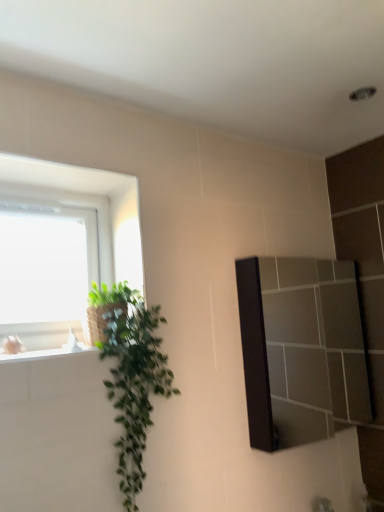
This screenshot has width=384, height=512. What do you see at coordinates (302, 349) in the screenshot?
I see `matte black mirror at right` at bounding box center [302, 349].

Where is `matte black mirror at right`? matte black mirror at right is located at coordinates (302, 349).

Describe the element at coordinates (131, 375) in the screenshot. The height and width of the screenshot is (512, 384). I see `green leafy plant at left` at that location.

You are a GUI agent. You are given a task and a screenshot of the screen. Output one action in this format:
    pyautogui.click(x=<x>, y=<y>)
    Task: Click on the green leafy plant at left
    The width and height of the screenshot is (384, 512).
    Given the screenshot: What is the action you would take?
    pyautogui.click(x=131, y=375)

You are a GUI agent. You are given a task and a screenshot of the screen. Output one action in this format:
    pyautogui.click(x=<x>, y=<y>)
    Task: Click on the matte black mirror at right
    
    Given the screenshot: What is the action you would take?
    pyautogui.click(x=302, y=349)

In the scene shown: Which object is positioned more to the right, matte black mirror at right or green leafy plant at left?

From the viewer's perspective, matte black mirror at right appears more on the right side.

Considering their positions, is matte black mirror at right located in front of or behind green leafy plant at left?

Clearly, matte black mirror at right is behind green leafy plant at left.

Is point (328, 377) farther from viewer compared to point (130, 398)?

Yes, point (328, 377) is behind point (130, 398).

From the image's perspective, is matte black mirror at right beneath green leafy plant at left?

No, from the image's perspective, matte black mirror at right is not beneath green leafy plant at left.

From a real-world perspective, between matte black mirror at right and green leafy plant at left, who is vertically higher?

matte black mirror at right.

Based on the photo, is matte black mirror at right wider or thinner than green leafy plant at left?

Clearly, matte black mirror at right has less width compared to green leafy plant at left.

Is matte black mirror at right shorter than green leafy plant at left?

Yes, matte black mirror at right is shorter than green leafy plant at left.

Based on their sizes in the image, would you say matte black mirror at right is bigger or smaller than green leafy plant at left?

In the image, matte black mirror at right appears to be smaller than green leafy plant at left.

Is matte black mirror at right spatially inside green leafy plant at left, or outside of it?

matte black mirror at right is located beyond the bounds of green leafy plant at left.

Are matte black mirror at right and green leafy plant at left making contact?

They are not placed beside each other.

Is matte black mirror at right facing away from green leafy plant at left?

No, green leafy plant at left is not at the back of matte black mirror at right.

Measure the distance between matte black mirror at right and green leafy plant at left.

matte black mirror at right and green leafy plant at left are 3.43 feet apart from each other.

Locate an element on the screen. Image resolution: width=384 pixels, height=512 pixels. mirror on the right of green leafy plant at left is located at coordinates (302, 349).

Based on the photo, which object is positioned more to the right, green leafy plant at left or matte black mirror at right?

matte black mirror at right.

Considering their positions, is green leafy plant at left located in front of or behind matte black mirror at right?

Clearly, green leafy plant at left is in front of matte black mirror at right.

Does point (165, 390) appear closer or farther from the camera than point (343, 322)?

Point (165, 390) is closer to the camera than point (343, 322).

Based on the photo, from the image's perspective, which object appears higher, green leafy plant at left or matte black mirror at right?

From the image's view, matte black mirror at right is above.

From a real-world perspective, which is physically above, green leafy plant at left or matte black mirror at right?

matte black mirror at right, from a real-world perspective.

Which object is wider, green leafy plant at left or matte black mirror at right?

green leafy plant at left.

Between green leafy plant at left and matte black mirror at right, which one has less height?

matte black mirror at right is shorter.

Which of these two, green leafy plant at left or matte black mirror at right, is smaller?

matte black mirror at right is smaller.

Is green leafy plant at left surrounding matte black mirror at right?

No, matte black mirror at right is not a part of green leafy plant at left.

Is green leafy plant at left touching matte black mirror at right?

No, green leafy plant at left is not in contact with matte black mirror at right.

Is green leafy plant at left looking in the opposite direction of matte black mirror at right?

No, green leafy plant at left's orientation is not away from matte black mirror at right.

Where is `mirror above the green leafy plant at left (from the image's perspective)`? The height and width of the screenshot is (512, 384). mirror above the green leafy plant at left (from the image's perspective) is located at coordinates (302, 349).

At what (x,y) coordinates should I click in order to perform the action: click on mirror above the green leafy plant at left (from the image's perspective). Please return your answer as a coordinate pair (x, y). This screenshot has height=512, width=384. Looking at the image, I should click on pyautogui.click(x=302, y=349).

This screenshot has height=512, width=384. I want to click on houseplant directly beneath the matte black mirror at right (from a real-world perspective), so coord(131,375).